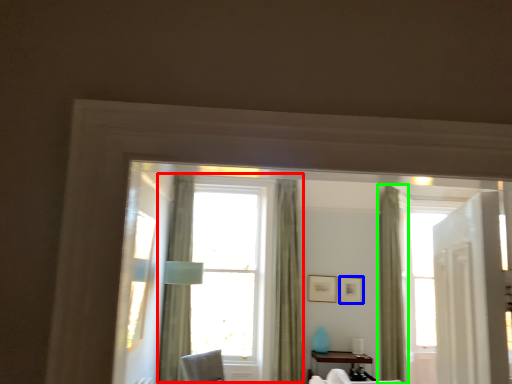
Question: Based on their relative distances, which object is farther from window (highlighted by a red box)? Choose from picture frame (highlighted by a blue box) and curtain (highlighted by a green box).

Choices:
 (A) picture frame
 (B) curtain

Answer: (B)